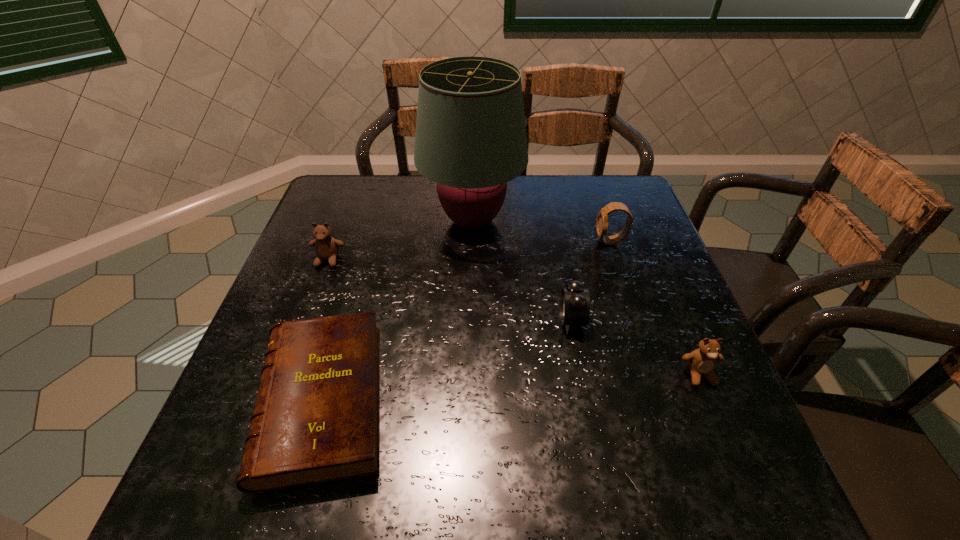
The image size is (960, 540). Identify the location of free space located 0.090m on the face of the watch. (562, 241).

You are a GUI agent. You are given a task and a screenshot of the screen. Output one action in this format:
    pyautogui.click(x=<x>, y=<y>)
    Task: Click on the free space located on the face of the watch
    The height and width of the screenshot is (540, 960).
    Given the screenshot: What is the action you would take?
    coord(494,241)

Where is `vacant space located 0.100m on the front-facing side of the farther teddy bear`? The width and height of the screenshot is (960, 540). vacant space located 0.100m on the front-facing side of the farther teddy bear is located at coordinates (314, 299).

Where is `free space located 0.200m on the front side of the fourth object from left to right`? free space located 0.200m on the front side of the fourth object from left to right is located at coordinates 468,320.

Image resolution: width=960 pixels, height=540 pixels. What are the coordinates of `free space located 0.100m on the front side of the fourth object from left to right` in the screenshot? It's located at (514, 320).

Locate an element on the screen. vacant space located on the front side of the fourth object from left to right is located at coordinates (415, 320).

At what (x,y) coordinates should I click in order to perform the action: click on blank space located on the front-facing side of the right teddy bear. Please return your answer as a coordinate pair (x, y). The height and width of the screenshot is (540, 960). Looking at the image, I should click on (748, 491).

You are a GUI agent. You are given a task and a screenshot of the screen. Output one action in this format:
    pyautogui.click(x=<x>, y=<y>)
    Task: Click on the free space located 0.360m on the back of the hardback book
    The image size is (960, 540).
    Given the screenshot: What is the action you would take?
    pyautogui.click(x=372, y=228)

Where is `object that is at the far edge`? This screenshot has width=960, height=540. object that is at the far edge is located at coordinates (470, 139).

Locate an element on the screen. This screenshot has height=540, width=960. object that is at the near edge is located at coordinates (316, 417).